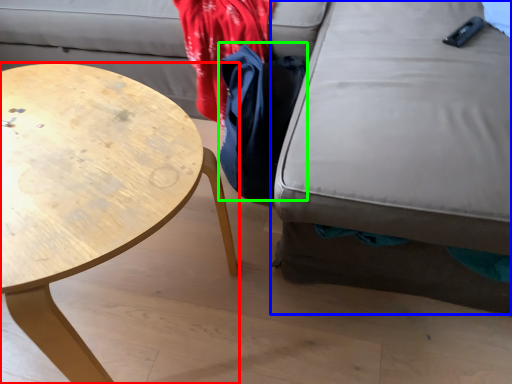
Question: Which object is the closest to the coffee table (highlighted by a red box)? Choose among these: swivel chair (highlighted by a blue box) or cloak (highlighted by a green box).

Choices:
 (A) swivel chair
 (B) cloak

Answer: (B)